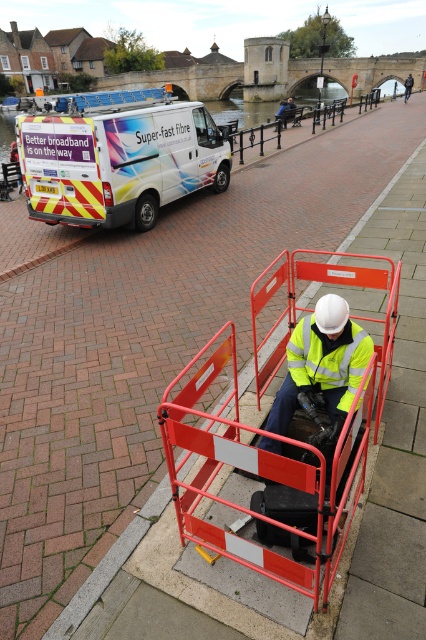
You are a delivery driver who needs to park your vehicle near the white glossy van at upper left. According to the coordinates provided, where should you position your vehicle to park safely?

The white glossy van at upper left is located at coordinates point (118,156), so you should park your vehicle near that point to ensure safe positioning.